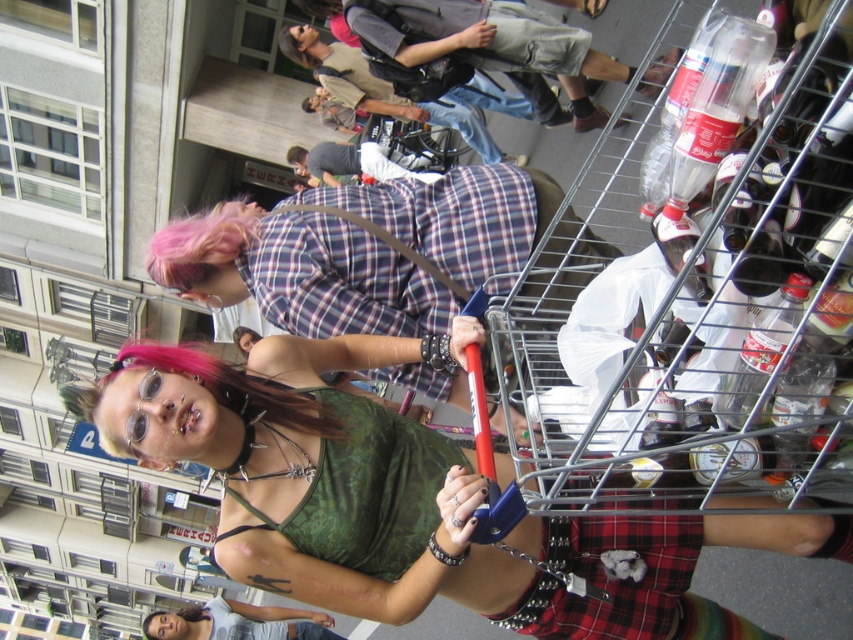
Question: Which object is the farthest from the green fabric tank top at center?

Choices:
 (A) clear plastic bottles at center
 (B) plaid shirt at center

Answer: (B)

Question: Which of the following is the farthest from the observer?

Choices:
 (A) green fabric tank top at center
 (B) clear plastic bottles at center

Answer: (A)

Question: Can you confirm if green fabric tank top at center is smaller than plaid shirt at center?

Choices:
 (A) yes
 (B) no

Answer: (A)

Question: Is green fabric tank top at center thinner than plaid shirt at center?

Choices:
 (A) yes
 (B) no

Answer: (B)

Question: Can you confirm if green fabric tank top at center is positioned to the left of plaid shirt at center?

Choices:
 (A) yes
 (B) no

Answer: (B)

Question: Among these objects, which one is nearest to the camera?

Choices:
 (A) green fabric tank top at center
 (B) plaid shirt at center
 (C) clear plastic bottles at center

Answer: (C)